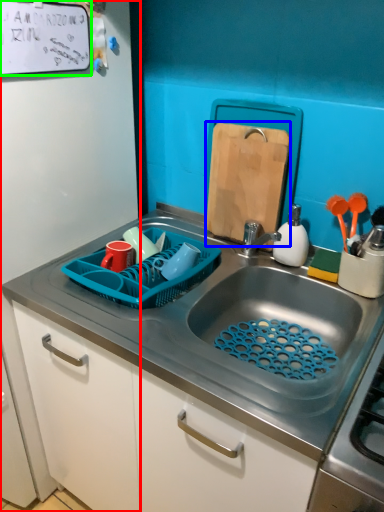
Question: Based on their relative distances, which object is nearer to side (highlighted by a red box)? Choose from cutting board (highlighted by a blue box) and bulletin board (highlighted by a green box).

Choices:
 (A) cutting board
 (B) bulletin board

Answer: (B)